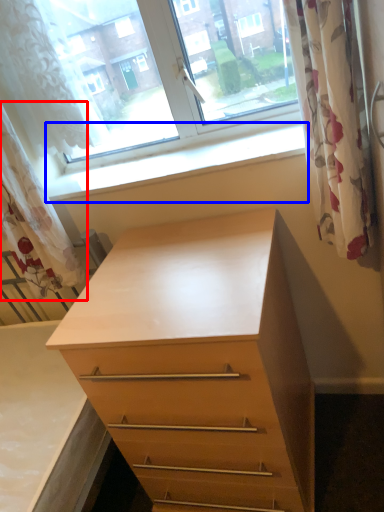
Question: Which point is further to the camera, curtain (highlighted by a red box) or window sill (highlighted by a blue box)?

Choices:
 (A) curtain
 (B) window sill

Answer: (B)